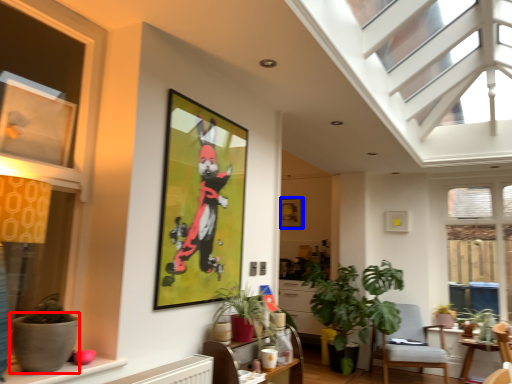
Question: Which point is further to the camera, flowerpot (highlighted by a red box) or picture frame (highlighted by a blue box)?

Choices:
 (A) flowerpot
 (B) picture frame

Answer: (B)